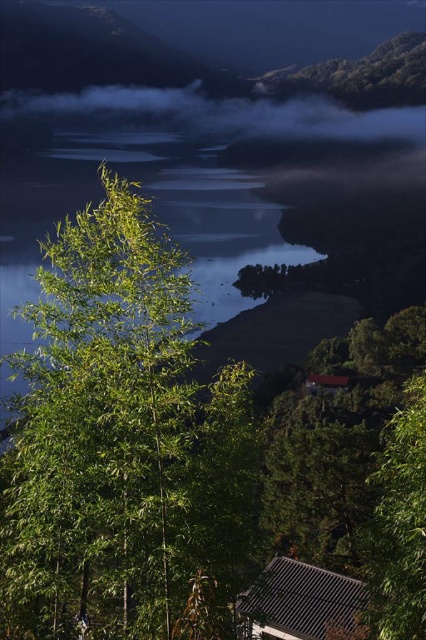
Looking at this image, you are standing at the viewpoint of the image and want to take a photo. There are two points marked in the scene, point 1 at coordinates point (5, 572) and point 2 at coordinates point (379, 522). Which point will appear larger in your photo?

Point 1 at coordinates point (5, 572) will appear larger in the photo because it is closer to the camera than point 2 at coordinates point (379, 522).